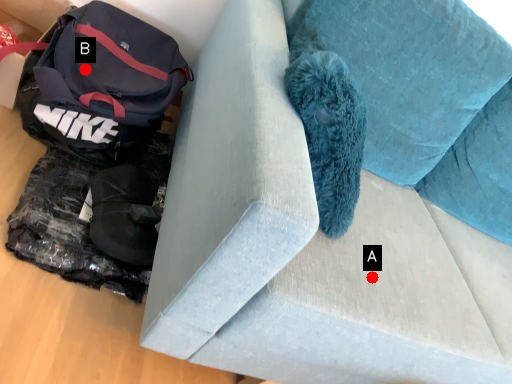
Question: Two points are circled on the image, labeled by A and B beside each circle. Which point is closer to the camera?

Choices:
 (A) A is closer
 (B) B is closer

Answer: (A)